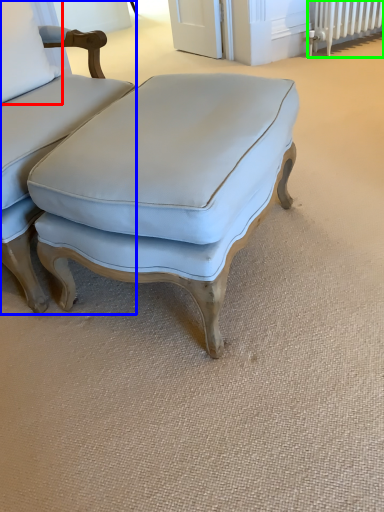
Question: Based on their relative distances, which object is nearer to pillow (highlighted by a red box)? Choose from chair (highlighted by a blue box) and radiator (highlighted by a green box).

Choices:
 (A) chair
 (B) radiator

Answer: (A)